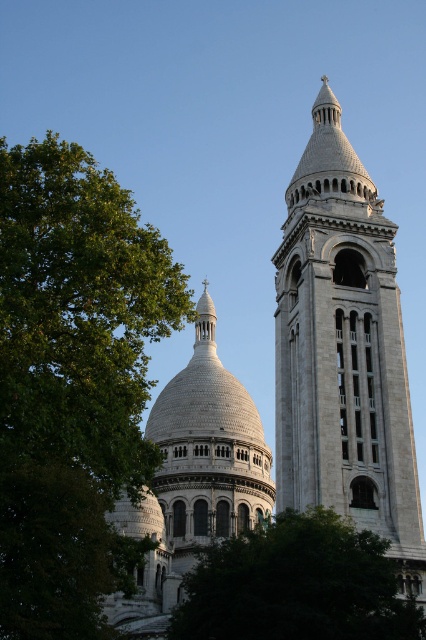
Does point (131, 532) lie in front of point (284, 554)?

No.

From the picture: Is white stone dome at center below green leafy tree at lower center?

Actually, white stone dome at center is above green leafy tree at lower center.

Does point (149, 604) come in front of point (276, 618)?

No.

Locate an element on the screen. The height and width of the screenshot is (640, 426). white stone dome at center is located at coordinates coord(192,481).

Is green leafy tree at left to the right of white stone dome at center from the viewer's perspective?

Incorrect, green leafy tree at left is not on the right side of white stone dome at center.

Is point (63, 568) less distant than point (158, 524)?

Yes, point (63, 568) is in front of point (158, 524).

Locate an element on the screen. Image resolution: width=426 pixels, height=640 pixels. green leafy tree at left is located at coordinates (72, 384).

Between white stone church at center and white stone tower at upper center, which one is positioned lower?

white stone church at center is lower down.

Is white stone church at center bigger than white stone tower at upper center?

Indeed, white stone church at center has a larger size compared to white stone tower at upper center.

This screenshot has height=640, width=426. I want to click on white stone church at center, so click(x=344, y=353).